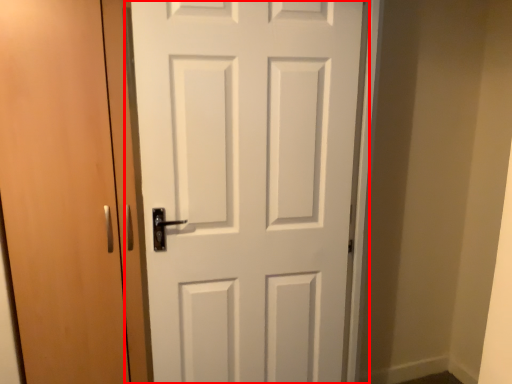
Question: From the image's perspective, where is door (annotated by the red box) located relative to door?

Choices:
 (A) above
 (B) below

Answer: (B)